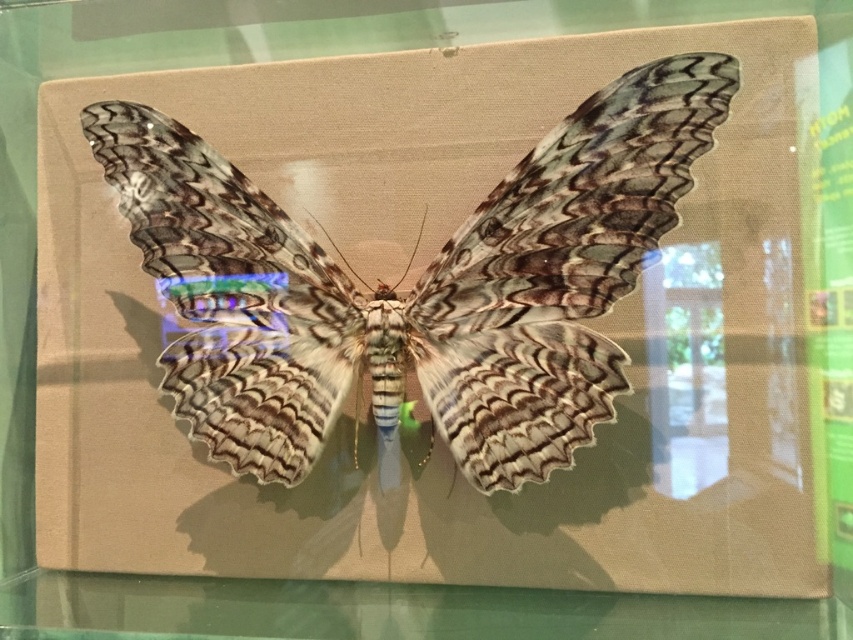
Based on the photo, between rustic wood butterfly at center and transparent glass table at lower center, which one has more height?

Standing taller between the two is rustic wood butterfly at center.

Between point (599, 90) and point (70, 616), which one is positioned behind?

Positioned behind is point (70, 616).

Is point (460, 456) farther from viewer compared to point (457, 634)?

Yes, point (460, 456) is behind point (457, 634).

Find the location of a particular element. The height and width of the screenshot is (640, 853). rustic wood butterfly at center is located at coordinates (415, 284).